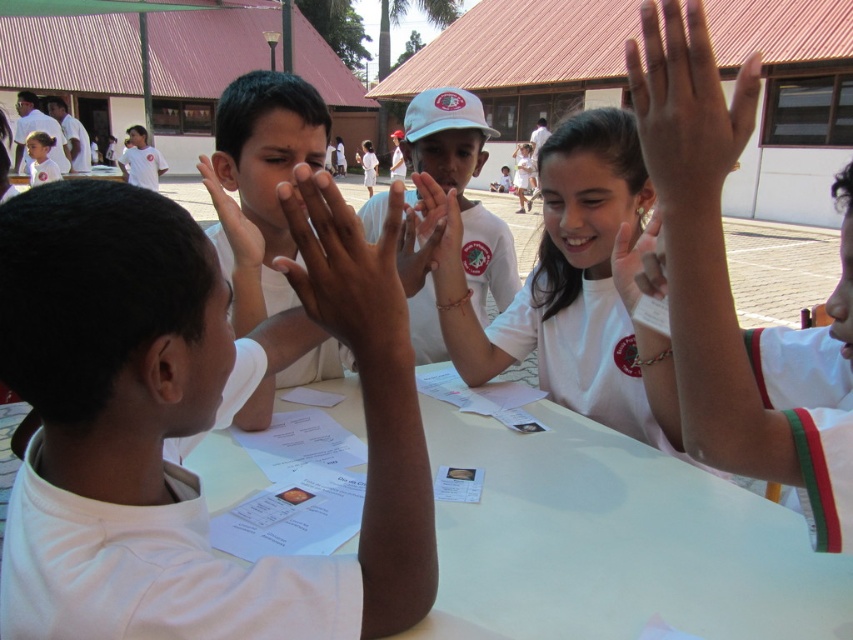
Based on the scene description, where exactly is the smooth skin hands at center located in the image?

The smooth skin hands at center is located at point (349,275) in the image.

In the scene, you see two smooth skin hands at center and a smooth skin hand at center. Which one is positioned lower?

The smooth skin hands at center is positioned lower than the smooth skin hand at center.